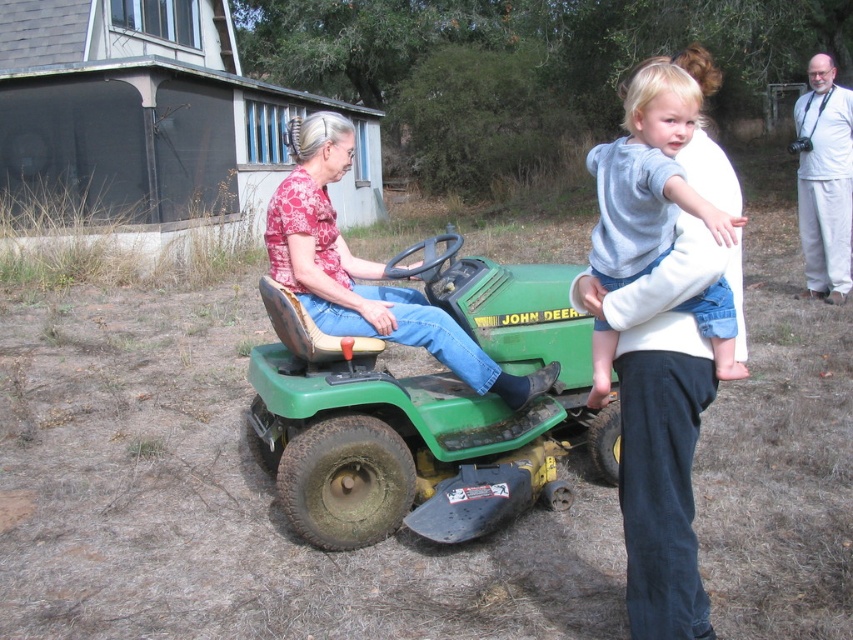
Based on the photo, based on the scene, if the green rubber tractor at center is blocking your view, would you still be able to see the light gray fleece shirt at upper right?

The light gray fleece shirt at upper right is behind the green rubber tractor at center, so if the tractor is blocking your view, you would not be able to see the light gray fleece shirt at upper right.

You are a photographer trying to capture a photo of the green rubber tractor at center and the matte pink shirt at center. Which object should you focus on first if you want to ensure both are in focus without adjusting the camera settings?

The green rubber tractor at center is taller than the matte pink shirt at center, so focusing on the taller green rubber tractor at center first would help ensure both are in focus since it is larger in the frame.